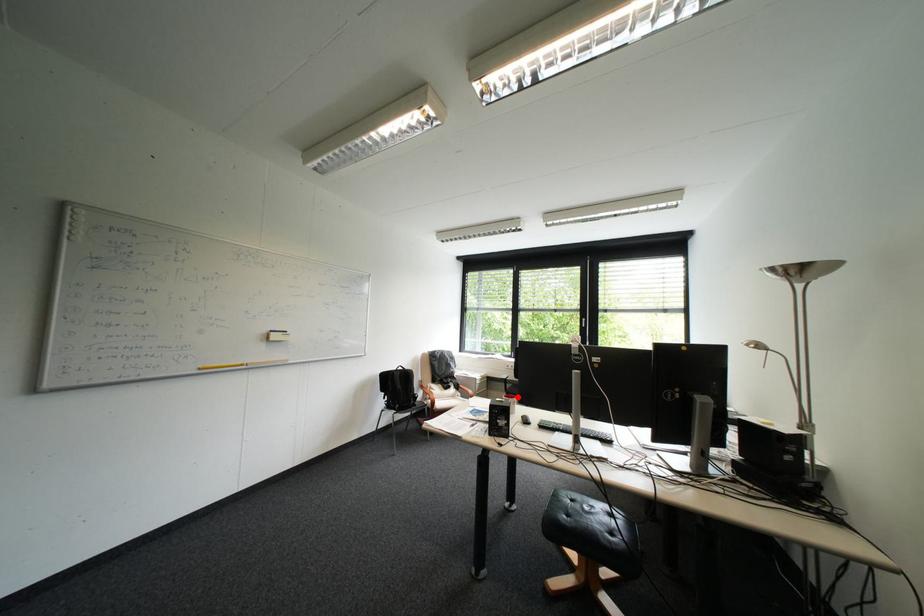
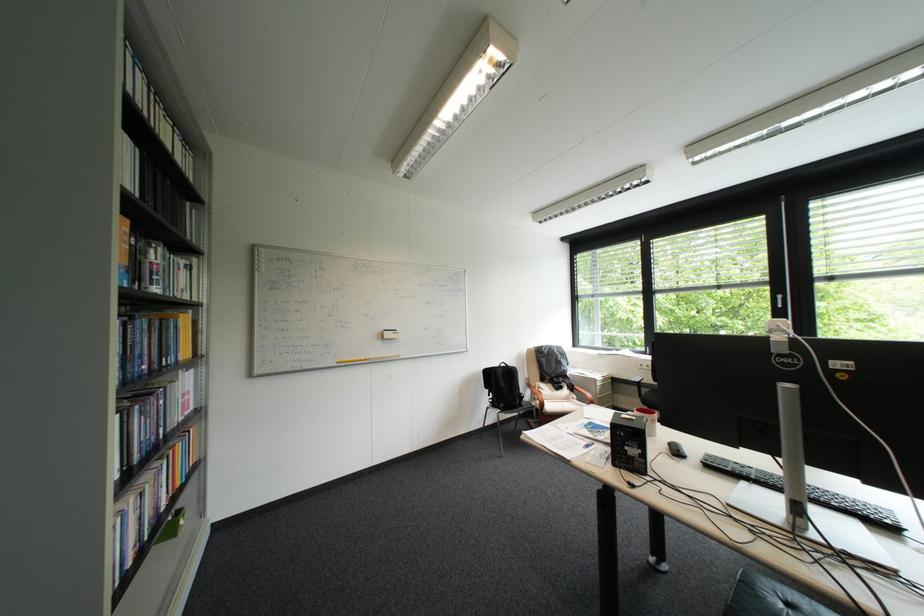
The point at the highlighted location is marked in the first image. Where is the corresponding point in the second image?

(650, 411)